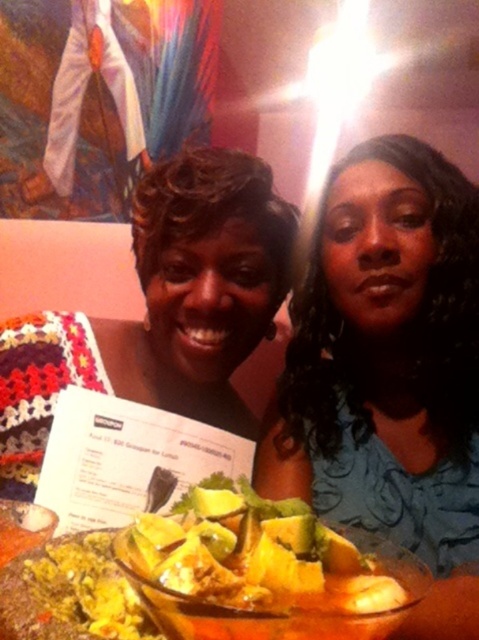
You are a waiter at a Mexican restaurant. You notice a customer looking at the white paper menu at center and pointing towards the yellowish tortilla chips at center. Can you tell them which item is closer to the menu?

The yellowish tortilla chips at center are to the right of the white paper menu at center, so the chips are closer to the menu than any other item mentioned.

Based on the photo, you are a photographer taking a picture of the blue satin dress at center and the yellowish tortilla chips at center. Which object should you focus on first if you want to capture both in the frame without moving the camera?

The blue satin dress at center is bigger than yellowish tortilla chips at center, so you should focus on the blue satin dress at center first to ensure it fills the frame appropriately before adjusting for the smaller chips.

You are a photographer trying to capture a closeup of the blue satin dress at center and the yellowish tortilla chips at center. Since the camera has a limited focus range, which object should you prioritize to ensure it fits within the frame?

The blue satin dress at center should be prioritized because its width is larger than the yellowish tortilla chips at center, making it more likely to fill the frame appropriately.